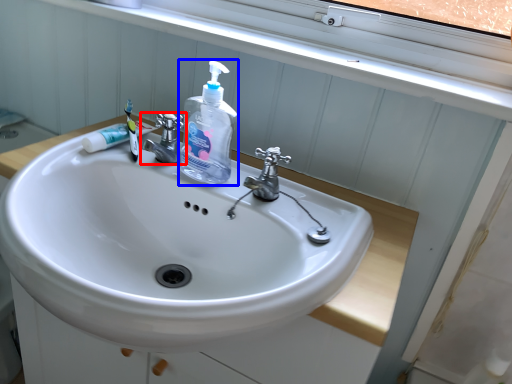
Question: Which object appears farthest to the camera in this image, tap (highlighted by a red box) or cleaning product (highlighted by a blue box)?

Choices:
 (A) tap
 (B) cleaning product

Answer: (A)